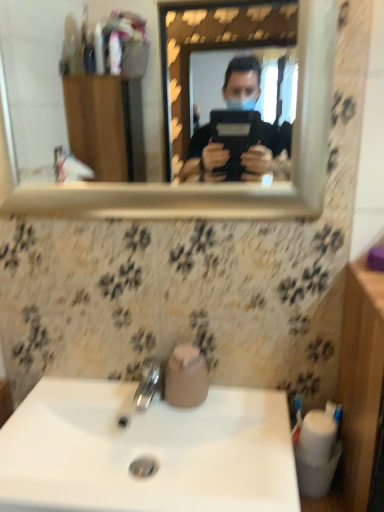
Question: Is white glossy sink at lower center taller or shorter than polished chrome tap at center?

Choices:
 (A) short
 (B) tall

Answer: (A)

Question: Considering the positions of white glossy sink at lower center and polished chrome tap at center in the image, is white glossy sink at lower center wider or thinner than polished chrome tap at center?

Choices:
 (A) wide
 (B) thin

Answer: (A)

Question: Estimate the real-world distances between objects in this image. Which object is farther from the gold-framed mirror at upper center?

Choices:
 (A) white glossy sink at lower center
 (B) pink matte toilet paper at sink
 (C) polished chrome tap at center

Answer: (B)

Question: Which of these objects is positioned farthest from the white glossy sink at lower center?

Choices:
 (A) gold-framed mirror at upper center
 (B) polished chrome tap at center
 (C) pink matte toilet paper at sink

Answer: (A)